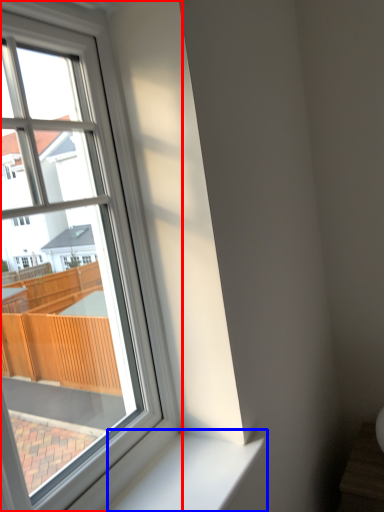
Question: Which of the following is the closest to the observer, window (highlighted by a red box) or window sill (highlighted by a blue box)?

Choices:
 (A) window
 (B) window sill

Answer: (A)